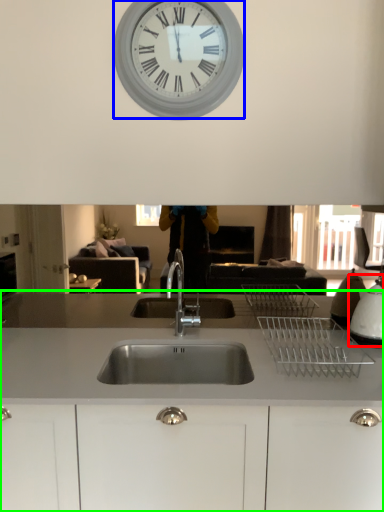
Question: Considering the real-world distances, which object is farthest from appliance (highlighted by a red box)? wall clock (highlighted by a blue box) or countertop (highlighted by a green box)?

Choices:
 (A) wall clock
 (B) countertop

Answer: (A)